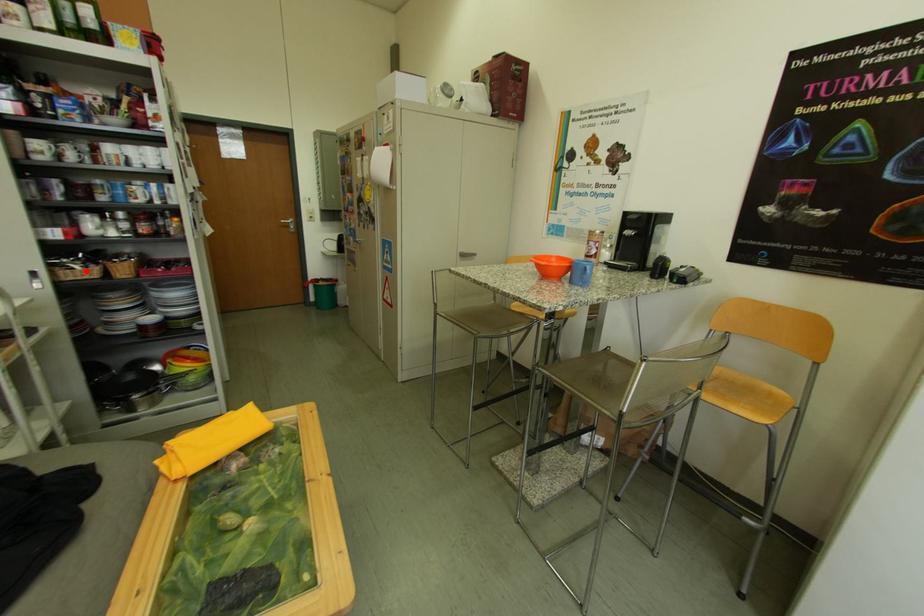
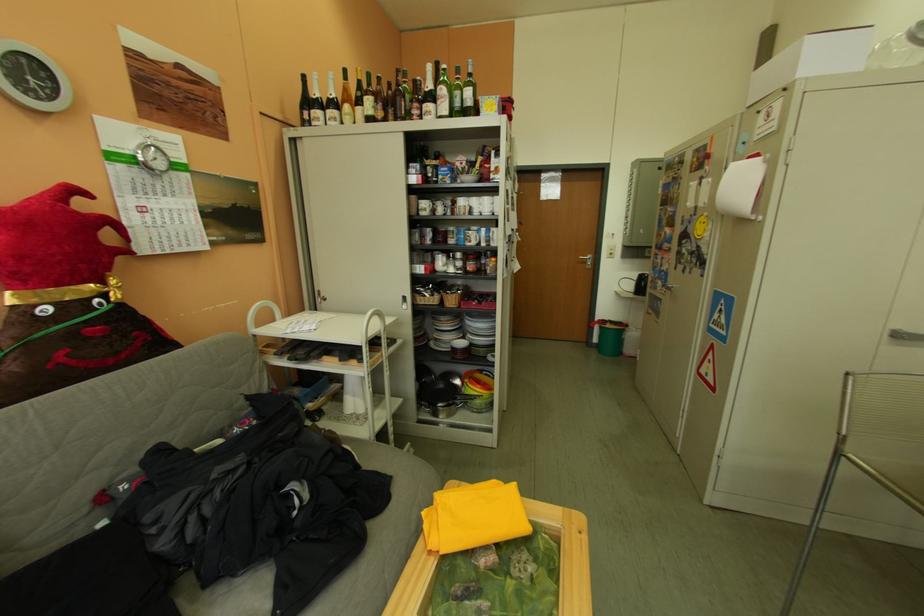
Locate, in the second image, the point that corresponds to the highlighted location in the first image.

(438, 299)